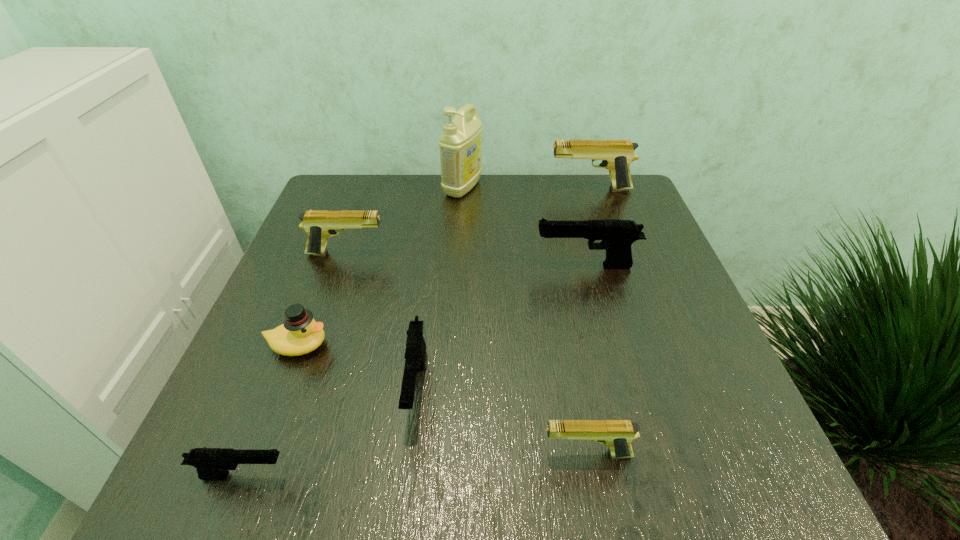
The width and height of the screenshot is (960, 540). Identify the location of detergent. (460, 144).

The image size is (960, 540). In order to click on beige detergent in this screenshot , I will do `click(460, 144)`.

Locate an element on the screen. the farthest tan pistol is located at coordinates (616, 155).

Locate an element on the screen. the biggest tan pistol is located at coordinates (616, 155).

At what (x,y) coordinates should I click in order to perform the action: click on the fourth nearest pistol. Please return your answer as a coordinate pair (x, y). The image size is (960, 540). Looking at the image, I should click on (617, 235).

Find the location of a particular element. This screenshot has height=540, width=960. the rightmost black pistol is located at coordinates (617, 235).

In order to click on the second nearest tan pistol in this screenshot , I will do `click(318, 224)`.

Locate an element on the screen. the third farthest object is located at coordinates (318, 224).

In order to click on the second biggest black pistol in this screenshot , I will do `click(415, 351)`.

The image size is (960, 540). Find the location of `the fourth pistol from right to left`. the fourth pistol from right to left is located at coordinates (415, 351).